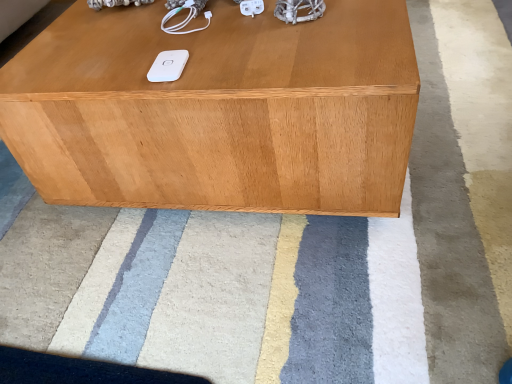
Question: From a real-world perspective, is white matte ipod at center positioned under light brown wood table at center based on gravity?

Choices:
 (A) yes
 (B) no

Answer: (B)

Question: Is white matte ipod at center oriented towards light brown wood table at center?

Choices:
 (A) no
 (B) yes

Answer: (A)

Question: Is the position of white matte ipod at center less distant than that of light brown wood table at center?

Choices:
 (A) no
 (B) yes

Answer: (A)

Question: Does white matte ipod at center have a lesser height compared to light brown wood table at center?

Choices:
 (A) yes
 (B) no

Answer: (A)

Question: Considering the relative sizes of white matte ipod at center and light brown wood table at center in the image provided, is white matte ipod at center wider than light brown wood table at center?

Choices:
 (A) yes
 (B) no

Answer: (B)

Question: Is there a large distance between white matte ipod at center and light brown wood table at center?

Choices:
 (A) yes
 (B) no

Answer: (B)

Question: From a real-world perspective, is white soft rug at center under light brown wood table at center?

Choices:
 (A) no
 (B) yes

Answer: (B)

Question: Can you confirm if white soft rug at center is positioned to the right of light brown wood table at center?

Choices:
 (A) yes
 (B) no

Answer: (B)

Question: Does white soft rug at center come in front of light brown wood table at center?

Choices:
 (A) yes
 (B) no

Answer: (A)

Question: Is white soft rug at center shorter than light brown wood table at center?

Choices:
 (A) no
 (B) yes

Answer: (B)

Question: Can you confirm if white soft rug at center is taller than light brown wood table at center?

Choices:
 (A) no
 (B) yes

Answer: (A)

Question: Considering the relative sizes of white soft rug at center and light brown wood table at center in the image provided, is white soft rug at center smaller than light brown wood table at center?

Choices:
 (A) yes
 (B) no

Answer: (B)

Question: Can you confirm if light brown wood table at center is positioned to the right of white soft rug at center?

Choices:
 (A) yes
 (B) no

Answer: (A)